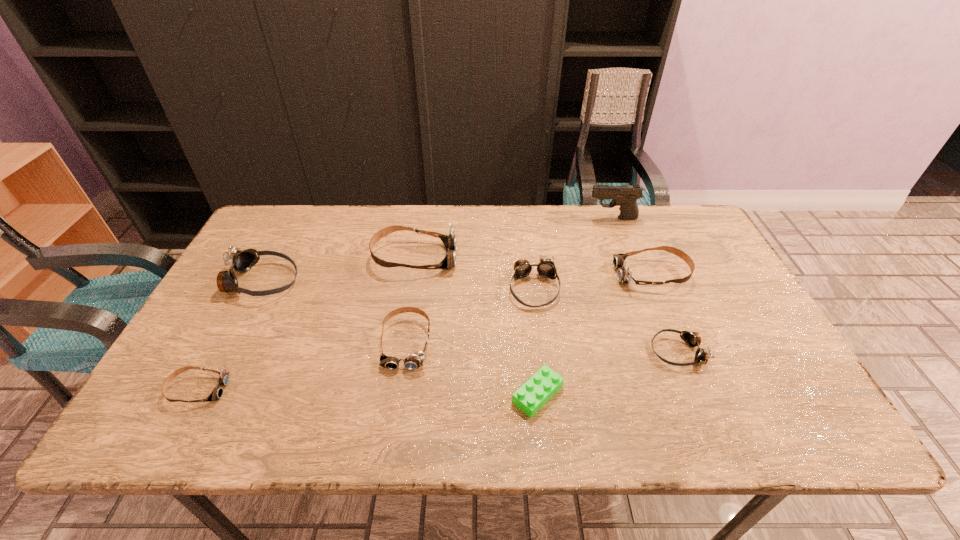
I want to click on goggles present at the near edge, so click(217, 393).

Locate an element on the screen. Image resolution: width=960 pixels, height=540 pixels. Lego situated at the near edge is located at coordinates (536, 391).

The width and height of the screenshot is (960, 540). I want to click on object situated at the right edge, so click(624, 275).

Where is `object at the near left corner`? object at the near left corner is located at coordinates (217, 393).

Locate an element on the screen. free point at the far edge is located at coordinates pyautogui.click(x=366, y=221).

This screenshot has width=960, height=540. In order to click on vacant region at the near edge of the desktop in this screenshot , I will do `click(466, 427)`.

Where is `vacant space at the left edge`? The image size is (960, 540). vacant space at the left edge is located at coordinates (248, 318).

In the image, there is a desktop. At what (x,y) coordinates should I click in order to perform the action: click on vacant space at the right edge. Please return your answer as a coordinate pair (x, y). The height and width of the screenshot is (540, 960). Looking at the image, I should click on (766, 352).

In the image, there is a desktop. In order to click on vacant space at the far right corner in this screenshot , I will do `click(682, 247)`.

Image resolution: width=960 pixels, height=540 pixels. What are the coordinates of `free space between the Lego and the biggest bronze goggles` in the screenshot? It's located at (399, 338).